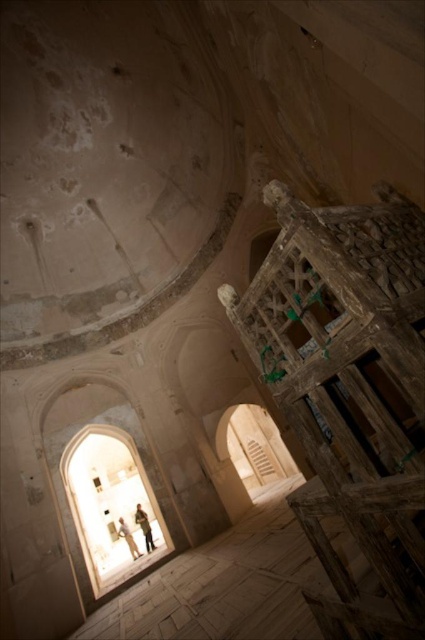
Question: Which of the following is the farthest from the observer?

Choices:
 (A) light brown leather jacket at lower center
 (B) light beige fabric person at lower center

Answer: (B)

Question: Can you confirm if light brown leather jacket at lower center is wider than light beige fabric person at lower center?

Choices:
 (A) yes
 (B) no

Answer: (B)

Question: Is light brown leather jacket at lower center wider than light beige fabric person at lower center?

Choices:
 (A) no
 (B) yes

Answer: (A)

Question: Which point appears closest to the camera in this image?

Choices:
 (A) (130, 550)
 (B) (142, 515)

Answer: (B)

Question: Can you confirm if light brown leather jacket at lower center is wider than light beige fabric person at lower center?

Choices:
 (A) yes
 (B) no

Answer: (B)